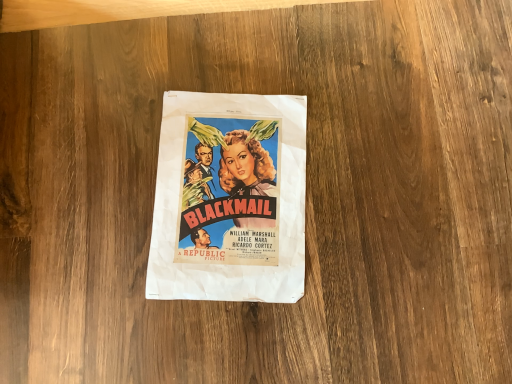
Identify the location of free space above matte paper poster at center (from a real-world perspective). (232, 194).